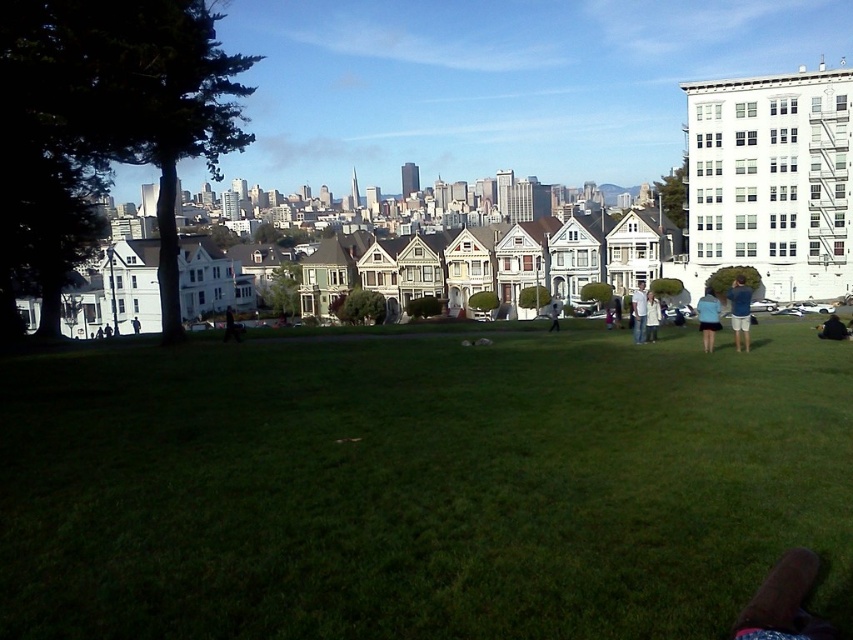
You are standing in the urban park and want to place a small bench between the two points labeled as point (x=380, y=387) and point (x=648, y=317). Since the bench is 1 meter long, will it fit between them?

The distance between point (x=380, y=387) and point (x=648, y=317) is not provided, so we cannot determine if the bench will fit. However, since point (x=380, y=387) is closer to the viewer than point (x=648, y=317), the bench may need to be placed accordingly based on their spatial arrangement.

You are planning to place a picnic blanket in the park. The blanket is 5 feet wide. If you want to place it between the green grass at center and the white matte jacket at center, will there be enough space?

The distance between the green grass at center and the white matte jacket at center is 103.49 feet. Since the picnic blanket is only 5 feet wide, there is more than enough space to place it between them.

Looking at this image, you are a photographer trying to capture a shot of the white matte jacket at center and the light blue jeans at center in the park scene. Based on their spatial relationship, which object would you need to frame wider in your camera to ensure both are fully visible?

The white matte jacket at center might be wider than light blue jeans at center, so you should frame the white matte jacket at center wider to ensure both are fully visible.